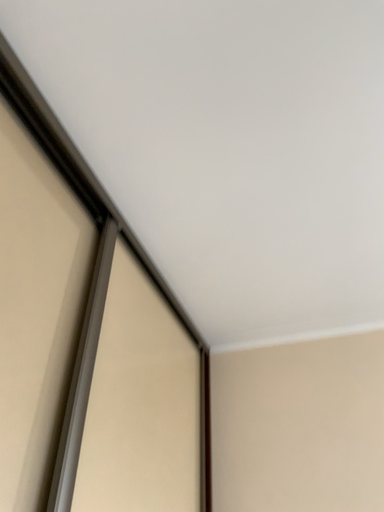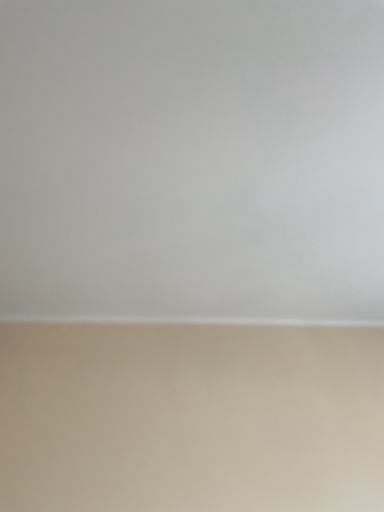
Question: How did the camera likely rotate when shooting the video?

Choices:
 (A) rotated right
 (B) rotated left

Answer: (A)